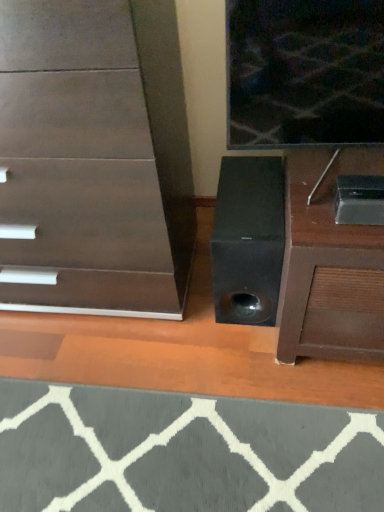
Question: From the image's perspective, does metallic silver speaker at lower right appear lower than gray woolen doormat at lower center?

Choices:
 (A) no
 (B) yes

Answer: (A)

Question: Is metallic silver speaker at lower right located outside gray woolen doormat at lower center?

Choices:
 (A) yes
 (B) no

Answer: (A)

Question: Is gray woolen doormat at lower center a part of metallic silver speaker at lower right?

Choices:
 (A) yes
 (B) no

Answer: (B)

Question: Is metallic silver speaker at lower right bigger than gray woolen doormat at lower center?

Choices:
 (A) yes
 (B) no

Answer: (A)

Question: Is metallic silver speaker at lower right oriented away from gray woolen doormat at lower center?

Choices:
 (A) no
 (B) yes

Answer: (A)

Question: Which is correct: metallic silver speaker at lower right is inside gray woolen doormat at lower center, or outside of it?

Choices:
 (A) inside
 (B) outside

Answer: (B)

Question: Considering the positions of metallic silver speaker at lower right and gray woolen doormat at lower center in the image, is metallic silver speaker at lower right taller or shorter than gray woolen doormat at lower center?

Choices:
 (A) tall
 (B) short

Answer: (A)

Question: From a real-world perspective, relative to gray woolen doormat at lower center, is metallic silver speaker at lower right vertically above or below?

Choices:
 (A) below
 (B) above

Answer: (B)

Question: In the image, is metallic silver speaker at lower right positioned in front of or behind gray woolen doormat at lower center?

Choices:
 (A) front
 (B) behind

Answer: (B)

Question: Would you say dark wood chest of drawers at center is to the left or to the right of gray woolen doormat at lower center in the picture?

Choices:
 (A) left
 (B) right

Answer: (A)

Question: From their relative heights in the image, would you say dark wood chest of drawers at center is taller or shorter than gray woolen doormat at lower center?

Choices:
 (A) tall
 (B) short

Answer: (A)

Question: Is dark wood chest of drawers at center inside the boundaries of gray woolen doormat at lower center, or outside?

Choices:
 (A) outside
 (B) inside

Answer: (A)

Question: From a real-world perspective, is dark wood chest of drawers at center positioned above or below gray woolen doormat at lower center?

Choices:
 (A) below
 (B) above

Answer: (B)

Question: Considering the positions of gray woolen doormat at lower center and metallic silver speaker at lower right in the image, is gray woolen doormat at lower center taller or shorter than metallic silver speaker at lower right?

Choices:
 (A) tall
 (B) short

Answer: (B)

Question: In terms of size, does gray woolen doormat at lower center appear bigger or smaller than metallic silver speaker at lower right?

Choices:
 (A) small
 (B) big

Answer: (A)